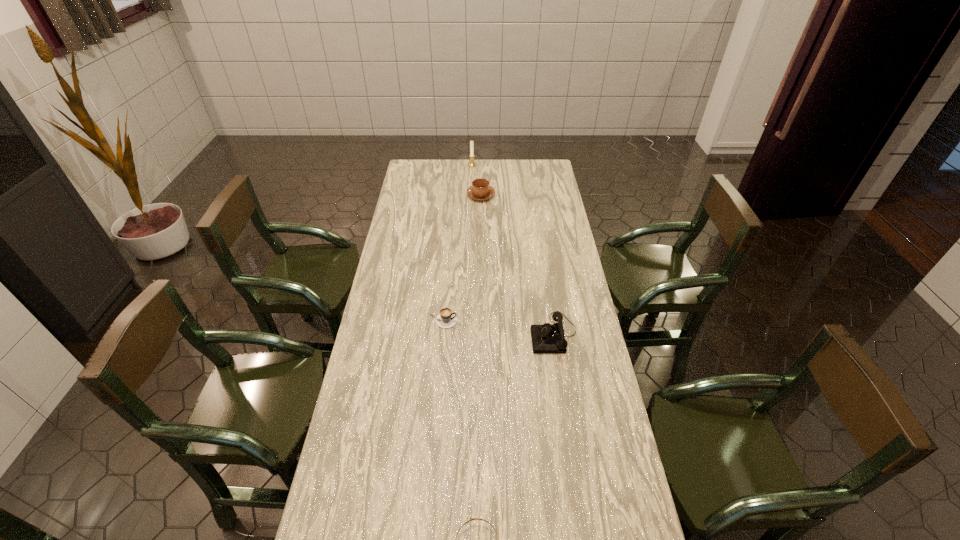
Image resolution: width=960 pixels, height=540 pixels. In order to click on the tallest object in this screenshot , I will do click(x=471, y=164).

The image size is (960, 540). I want to click on candle holder, so click(x=471, y=164).

I want to click on telephone, so click(x=548, y=338).

Where is `the rightmost object`? the rightmost object is located at coordinates (548, 338).

The width and height of the screenshot is (960, 540). I want to click on the third shortest object, so click(480, 190).

This screenshot has width=960, height=540. I want to click on the farther cappuccino, so click(x=480, y=190).

What are the coordinates of `the fourth tallest object` in the screenshot? It's located at (446, 319).

Where is `the leftmost object`? the leftmost object is located at coordinates (446, 319).

Identify the location of vacant position located on the front of the farthest object. (471, 204).

Find the location of a particular element. vacant space situated 0.110m on the front face of the rightmost object is located at coordinates (500, 334).